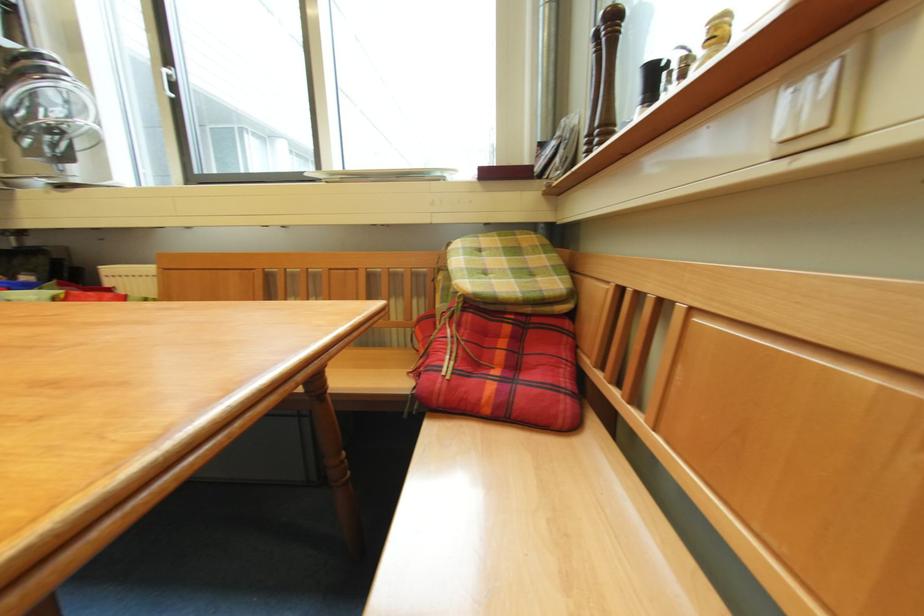
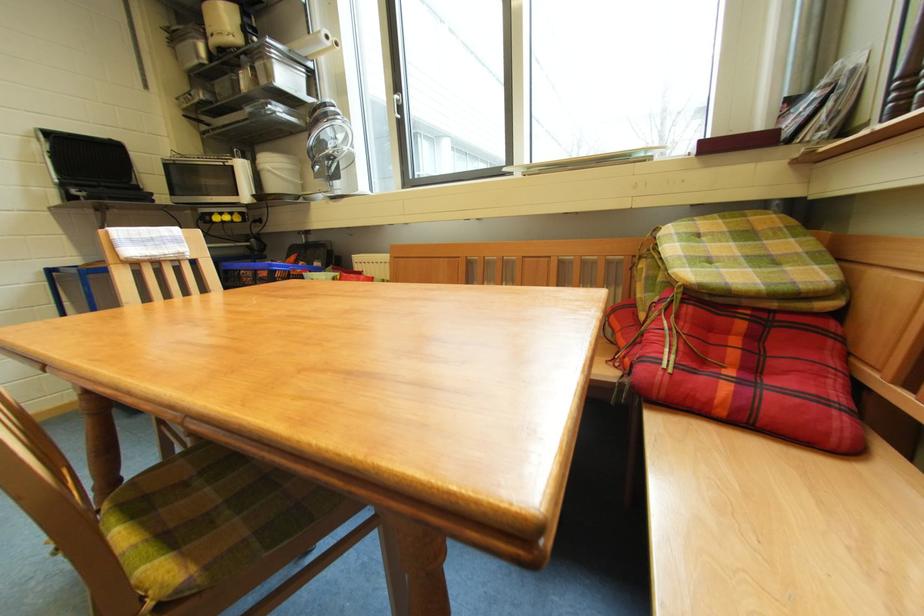
The point at (171,75) is marked in the first image. Where is the corresponding point in the second image?

(402, 102)